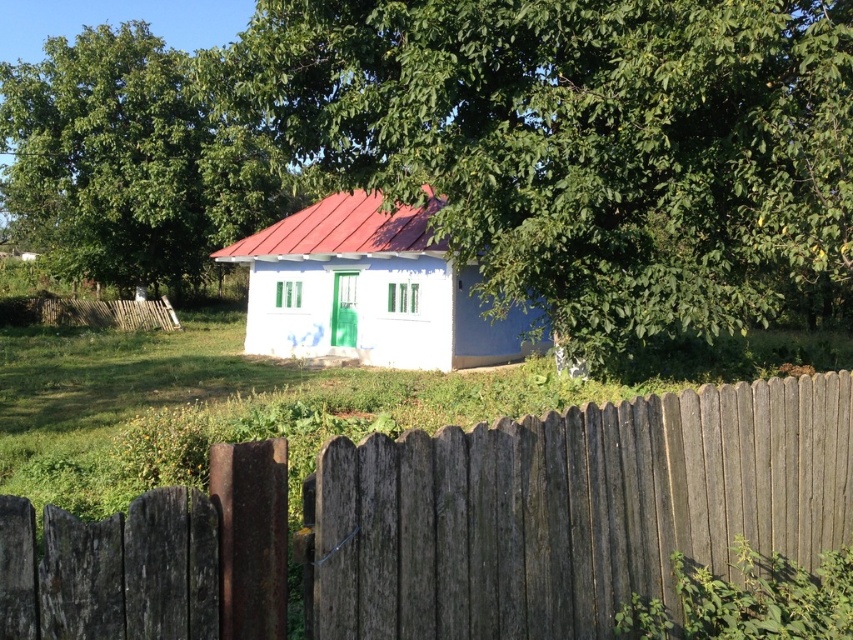
Question: Which point appears farthest from the camera in this image?

Choices:
 (A) (676, 284)
 (B) (13, 212)

Answer: (B)

Question: Is green leafy tree at center further to the viewer compared to white matte house at center?

Choices:
 (A) yes
 (B) no

Answer: (B)

Question: Is weathered wood fence at center smaller than white matte house at center?

Choices:
 (A) no
 (B) yes

Answer: (A)

Question: Which point appears farthest from the camera in this image?

Choices:
 (A) (410, 49)
 (B) (384, 304)
 (C) (834, 400)
 (D) (200, 156)

Answer: (D)

Question: Can you confirm if weathered wood fence at center is wider than green leafy tree at upper left?

Choices:
 (A) no
 (B) yes

Answer: (A)

Question: Which object is farther from the camera taking this photo?

Choices:
 (A) green leafy tree at upper left
 (B) weathered wood fence at center

Answer: (A)